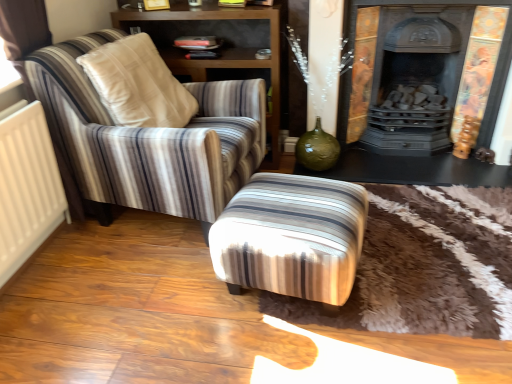
The width and height of the screenshot is (512, 384). I want to click on vacant area on top of black glossy table at lower right (from a real-world perspective), so click(400, 157).